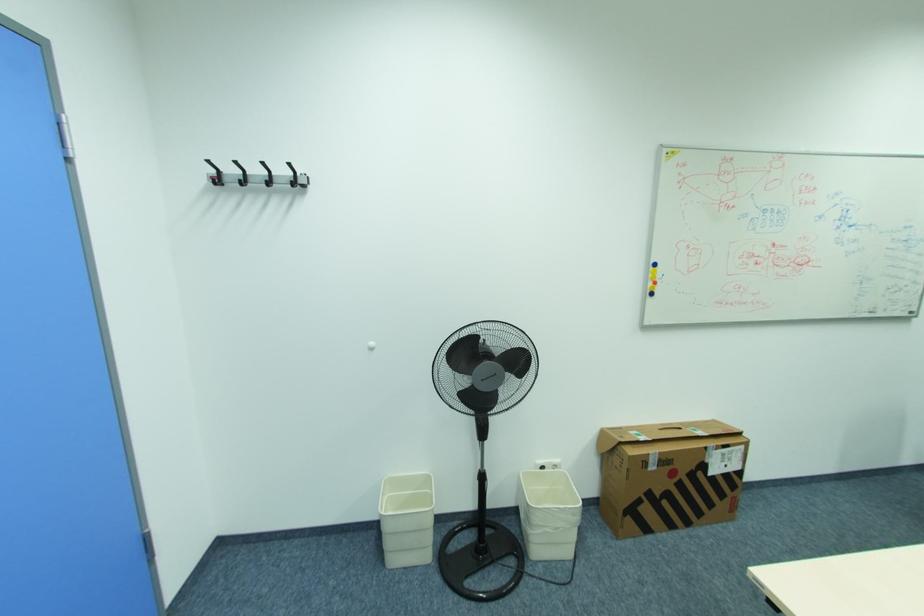
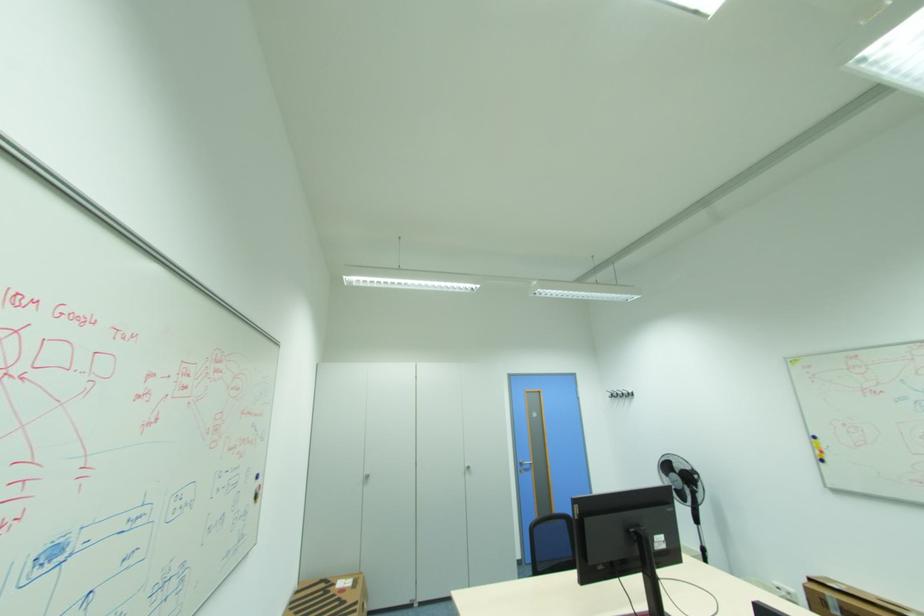
Locate, in the second image, the point that corresponds to (x=655, y=284) in the first image.

(822, 453)